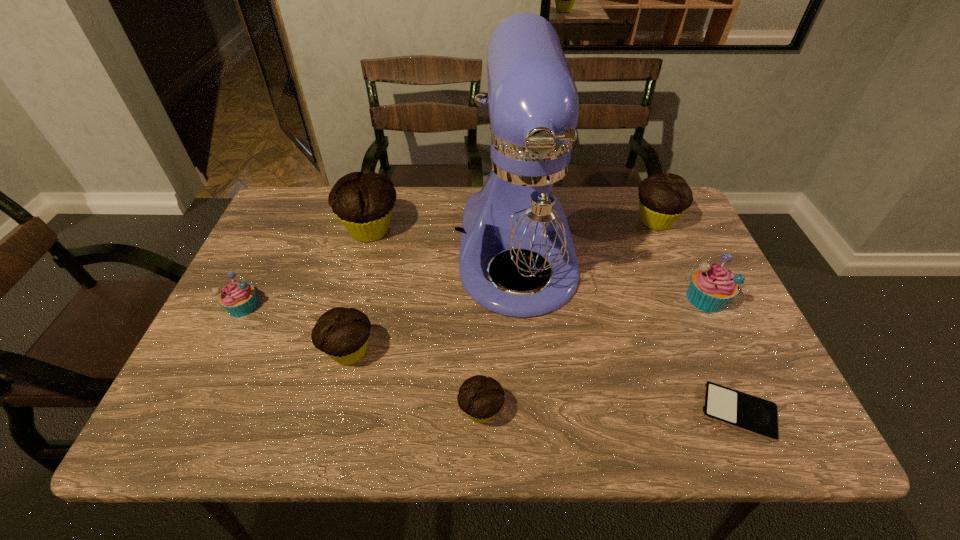
Image resolution: width=960 pixels, height=540 pixels. I want to click on free space located on the right of the leftmost object, so click(x=420, y=306).

Locate an element on the screen. vacant point located 0.270m on the back of the smallest chocolate muffin is located at coordinates (481, 294).

The width and height of the screenshot is (960, 540). Find the location of `free spot located 0.250m on the left of the iPod`. free spot located 0.250m on the left of the iPod is located at coordinates (575, 412).

This screenshot has height=540, width=960. Find the location of `mixer that is positioned at the far edge`. mixer that is positioned at the far edge is located at coordinates (526, 209).

The width and height of the screenshot is (960, 540). In order to click on muffin at the near edge in this screenshot , I will do `click(481, 398)`.

At what (x,y) coordinates should I click in order to perform the action: click on iPod that is at the near edge. Please return your answer as a coordinate pair (x, y). This screenshot has height=540, width=960. Looking at the image, I should click on (751, 414).

You are a GUI agent. You are given a task and a screenshot of the screen. Output one action in this format:
    pyautogui.click(x=<x>, y=<y>)
    Task: Click on the object present at the left edge
    This screenshot has width=960, height=540.
    Given the screenshot: What is the action you would take?
    pyautogui.click(x=238, y=298)

The width and height of the screenshot is (960, 540). I want to click on iPod located at the right edge, so click(x=751, y=414).

Find the location of a particular element. object at the far right corner is located at coordinates (663, 198).

Image resolution: width=960 pixels, height=540 pixels. I want to click on object at the near right corner, so click(x=751, y=414).